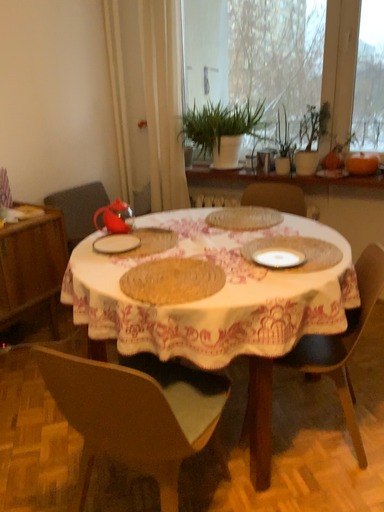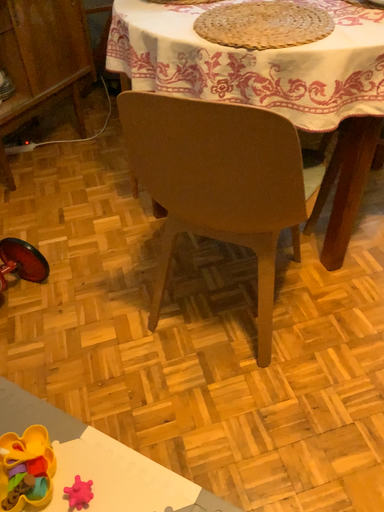
Question: Which way did the camera rotate in the video?

Choices:
 (A) rotated upward
 (B) rotated downward

Answer: (B)